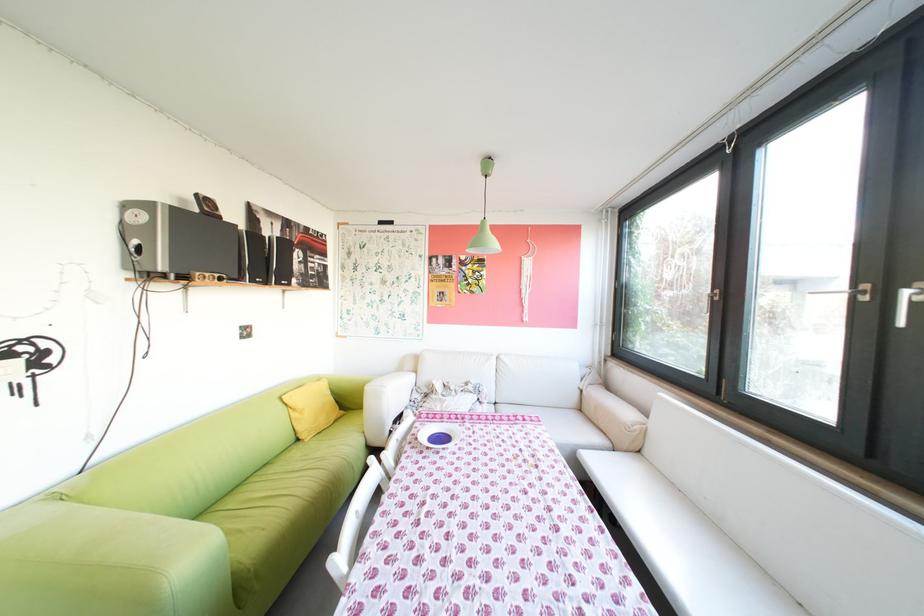
This screenshot has width=924, height=616. I want to click on white sofa surface, so click(505, 416).